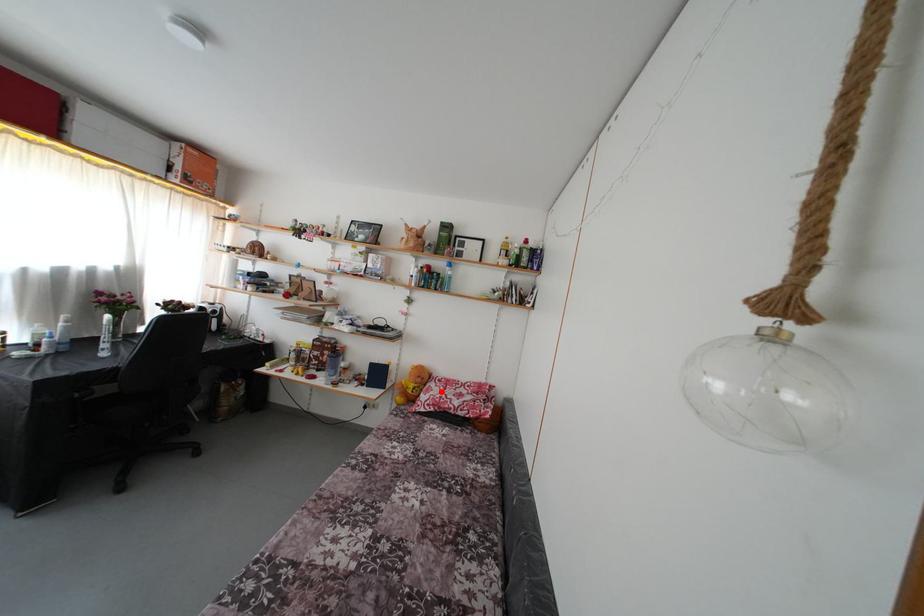
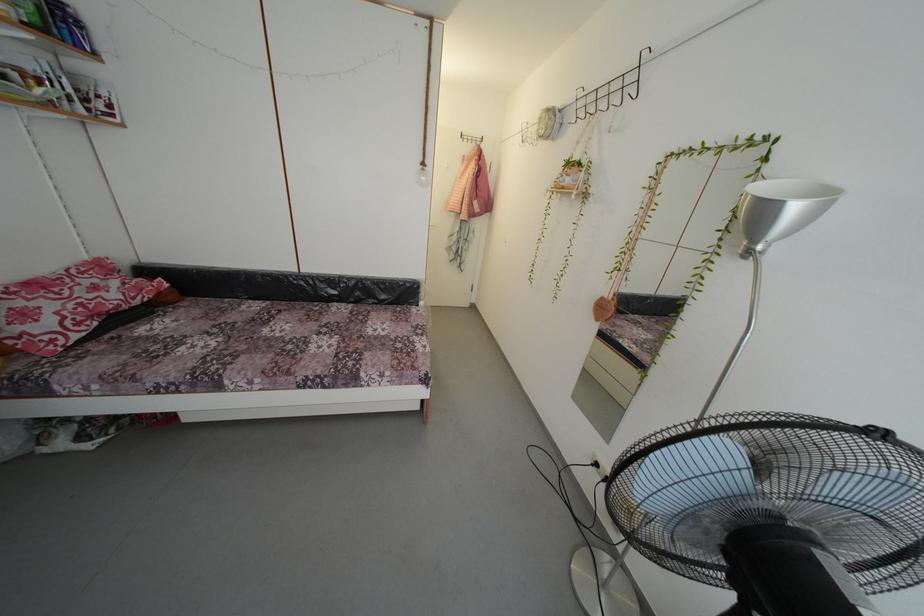
Locate, in the second image, the point that corresponds to the highlighted location in the first image.

(34, 306)